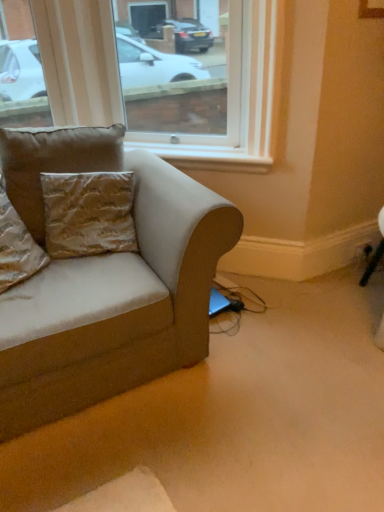
Question: Is suede-like beige couch at left aimed at white painted wood at upper center?

Choices:
 (A) no
 (B) yes

Answer: (A)

Question: Is suede-like beige couch at left bigger than white painted wood at upper center?

Choices:
 (A) yes
 (B) no

Answer: (A)

Question: Is suede-like beige couch at left outside white painted wood at upper center?

Choices:
 (A) no
 (B) yes

Answer: (B)

Question: From the image's perspective, would you say suede-like beige couch at left is positioned over white painted wood at upper center?

Choices:
 (A) yes
 (B) no

Answer: (B)

Question: Is suede-like beige couch at left to the left of white painted wood at upper center from the viewer's perspective?

Choices:
 (A) yes
 (B) no

Answer: (A)

Question: Considering the positions of point (228, 217) and point (44, 136), is point (228, 217) closer or farther from the camera than point (44, 136)?

Choices:
 (A) closer
 (B) farther

Answer: (A)

Question: In terms of height, does suede-like beige couch at left look taller or shorter compared to gold textured pillow at upper left, which is counted as the second pillow, starting from the left?

Choices:
 (A) tall
 (B) short

Answer: (A)

Question: Is suede-like beige couch at left in front of or behind gold textured pillow at upper left, which ranks as the first pillow in right-to-left order, in the image?

Choices:
 (A) front
 (B) behind

Answer: (A)

Question: In the image, is suede-like beige couch at left on the left side or the right side of gold textured pillow at upper left, which is counted as the second pillow, starting from the left?

Choices:
 (A) left
 (B) right

Answer: (B)

Question: Is suede-like beige couch at left bigger or smaller than transparent glass window at upper center?

Choices:
 (A) small
 (B) big

Answer: (B)

Question: Visually, is suede-like beige couch at left positioned to the left or to the right of transparent glass window at upper center?

Choices:
 (A) left
 (B) right

Answer: (A)

Question: Is suede-like beige couch at left in front of or behind transparent glass window at upper center in the image?

Choices:
 (A) behind
 (B) front

Answer: (B)

Question: From a real-world perspective, relative to transparent glass window at upper center, is suede-like beige couch at left vertically above or below?

Choices:
 (A) above
 (B) below

Answer: (B)

Question: In the image, is transparent glass window at upper center positioned in front of or behind suede-like beige couch at left?

Choices:
 (A) front
 (B) behind

Answer: (B)

Question: Based on their sizes in the image, would you say transparent glass window at upper center is bigger or smaller than suede-like beige couch at left?

Choices:
 (A) small
 (B) big

Answer: (A)